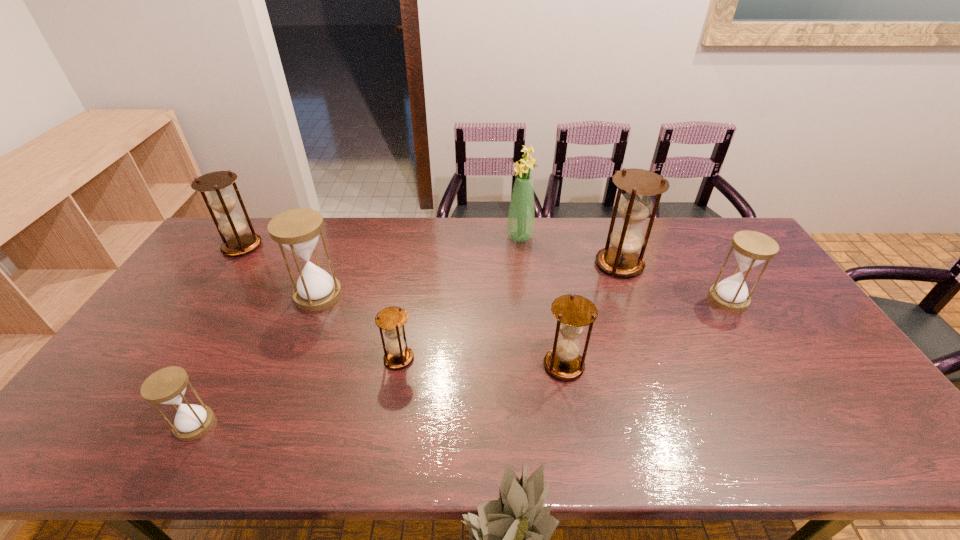
What are the coordinates of `vacant region between the fifth object from right to left and the second brown hourglass from right to left` in the screenshot? It's located at (481, 362).

Locate an element on the screen. Image resolution: width=960 pixels, height=540 pixels. object that ranks as the closest to the second white hourglass from left to right is located at coordinates (391, 319).

Point out which object is positioned as the third nearest to the biggest white hourglass. Please provide its 2D coordinates. Your answer should be formatted as a tuple, i.e. [(x, y)], where the tuple contains the x and y coordinates of a point satisfying the conditions above.

[(167, 386)]

Point out which hourglass is positioned as the second nearest to the green bouquet. Please provide its 2D coordinates. Your answer should be formatted as a tuple, i.e. [(x, y)], where the tuple contains the x and y coordinates of a point satisfying the conditions above.

[(573, 312)]

Find the location of `hourglass object that ranks as the fifth closest to the second brown hourglass from left to right`. hourglass object that ranks as the fifth closest to the second brown hourglass from left to right is located at coordinates (233, 226).

Select which brown hourglass appears as the closest to the leftmost hourglass. Please provide its 2D coordinates. Your answer should be formatted as a tuple, i.e. [(x, y)], where the tuple contains the x and y coordinates of a point satisfying the conditions above.

[(391, 319)]

At what (x,y) coordinates should I click in order to perform the action: click on brown hourglass that is the second closest to the third brown hourglass from right to left. Please return your answer as a coordinate pair (x, y). The image size is (960, 540). Looking at the image, I should click on (621, 259).

Locate an element on the screen. The height and width of the screenshot is (540, 960). white hourglass that is the third closest to the third smallest brown hourglass is located at coordinates (751, 248).

Identify which white hourglass is the third nearest to the second biggest brown hourglass. Please provide its 2D coordinates. Your answer should be formatted as a tuple, i.e. [(x, y)], where the tuple contains the x and y coordinates of a point satisfying the conditions above.

[(751, 248)]

In order to click on free space that satisfies the following two spatial constraints: 1. on the back side of the leftmost white hourglass; 2. on the right side of the fifth hourglass from left to right in this screenshot , I will do `click(227, 366)`.